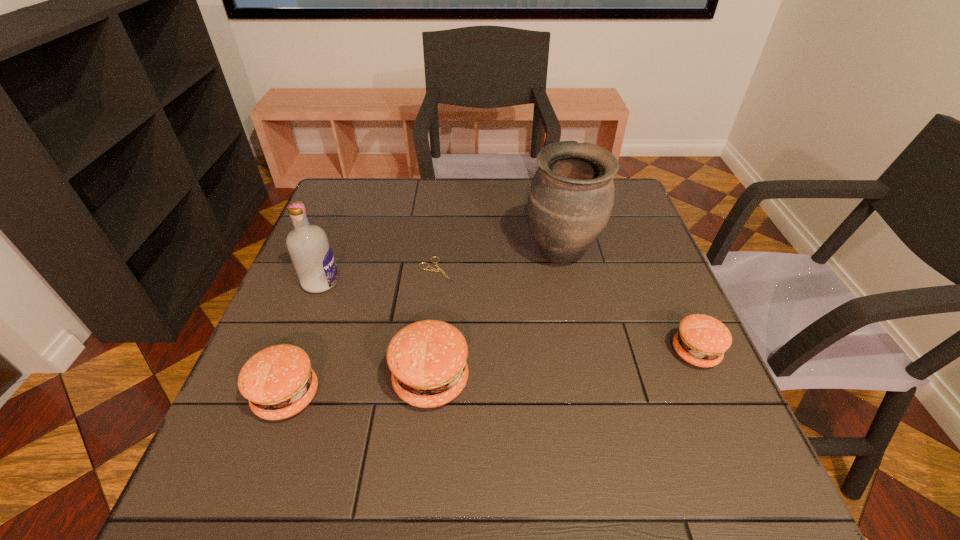
Please point a spot to place another patty_(food) for symmetrical spacing. Please provide its 2D coordinates. Your answer should be formatted as a tuple, i.e. [(x, y)], where the tuple contains the x and y coordinates of a point satisfying the conditions above.

[(566, 366)]